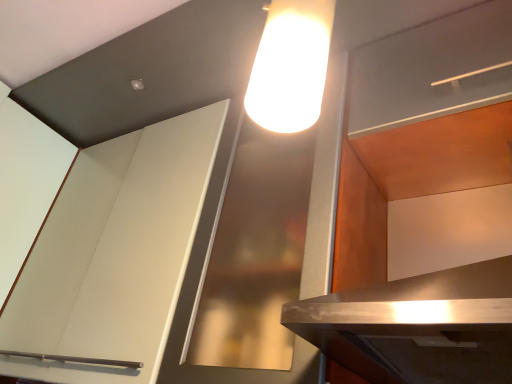
Find the location of a particular element. The height and width of the screenshot is (384, 512). free spot below matte wood shelf at upper right (from a real-world perspective) is located at coordinates (445, 150).